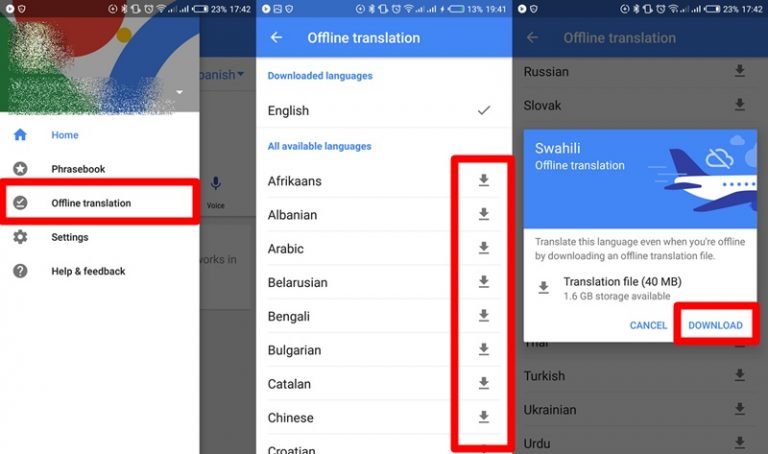
Image resolution: width=768 pixels, height=454 pixels. I want to click on window frame white background, so click(91, 394), click(425, 76), click(574, 325).